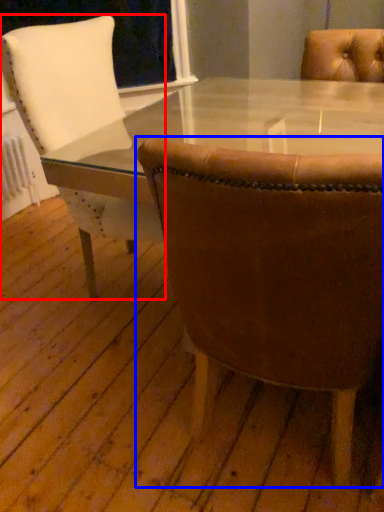
Question: Which object appears farthest to the camera in this image, chair (highlighted by a red box) or chair (highlighted by a blue box)?

Choices:
 (A) chair
 (B) chair

Answer: (A)